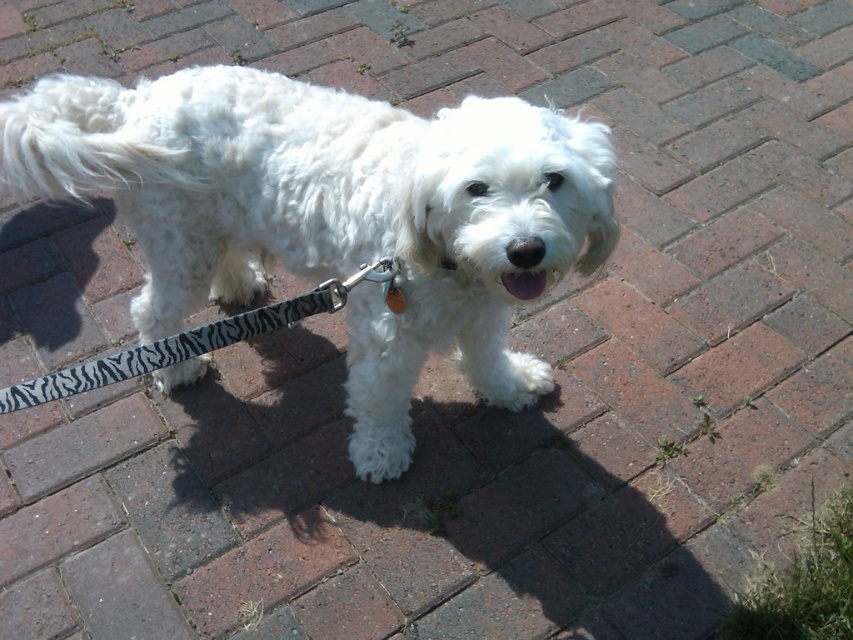
Question: Is white fluffy dog at center to the right of zebra-patterned fabric leash at lower center from the viewer's perspective?

Choices:
 (A) yes
 (B) no

Answer: (A)

Question: Can you confirm if white fluffy dog at center is positioned below zebra-patterned fabric leash at lower center?

Choices:
 (A) yes
 (B) no

Answer: (B)

Question: Does white fluffy dog at center have a smaller size compared to zebra-patterned fabric leash at lower center?

Choices:
 (A) no
 (B) yes

Answer: (A)

Question: Among these objects, which one is nearest to the camera?

Choices:
 (A) zebra-patterned fabric leash at lower center
 (B) white fluffy dog at center

Answer: (B)